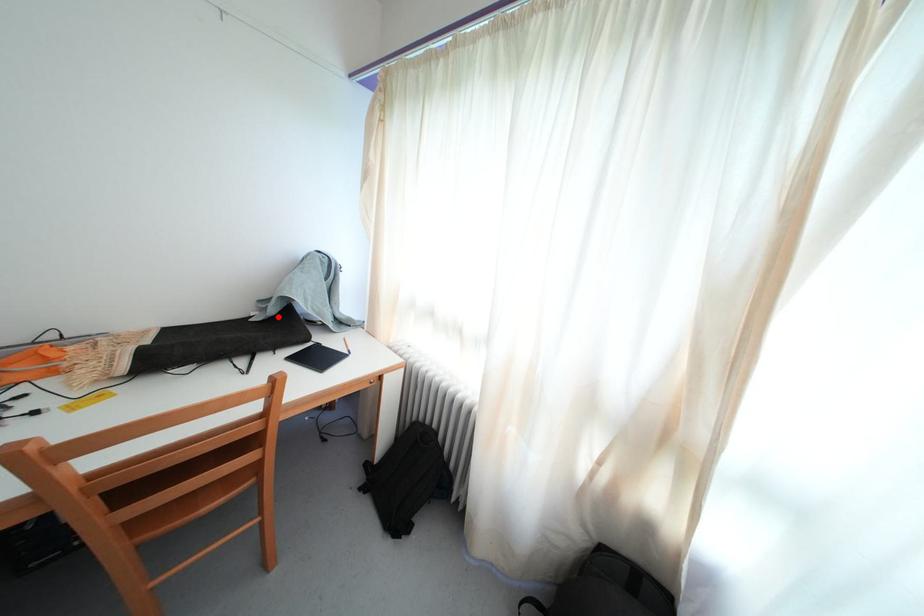
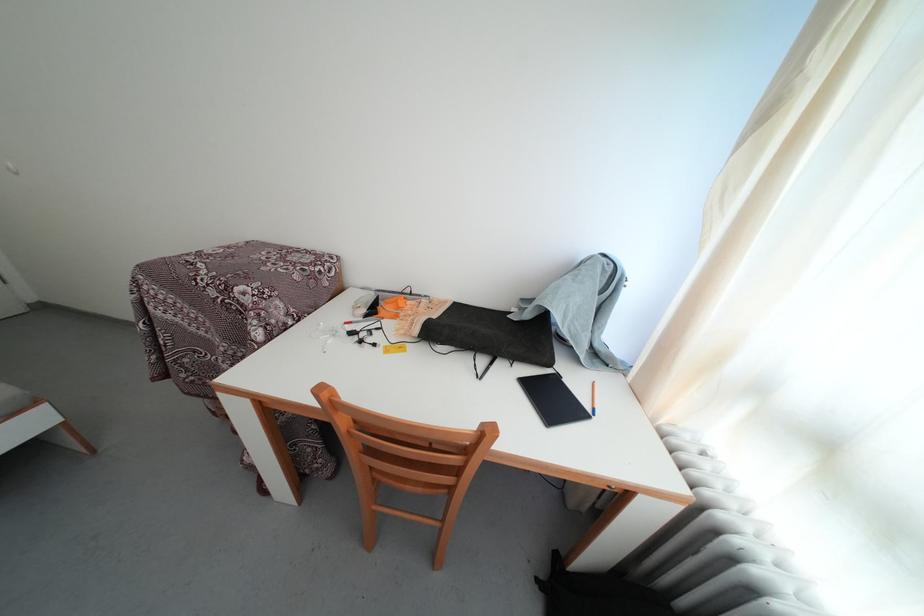
Locate, in the second image, the point that corresponds to the highlighted location in the first image.

(533, 322)